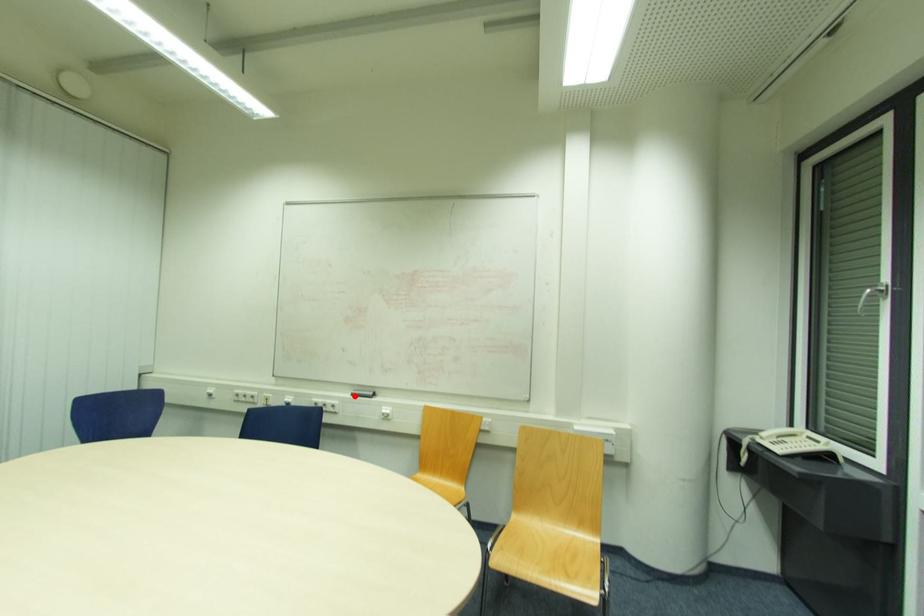
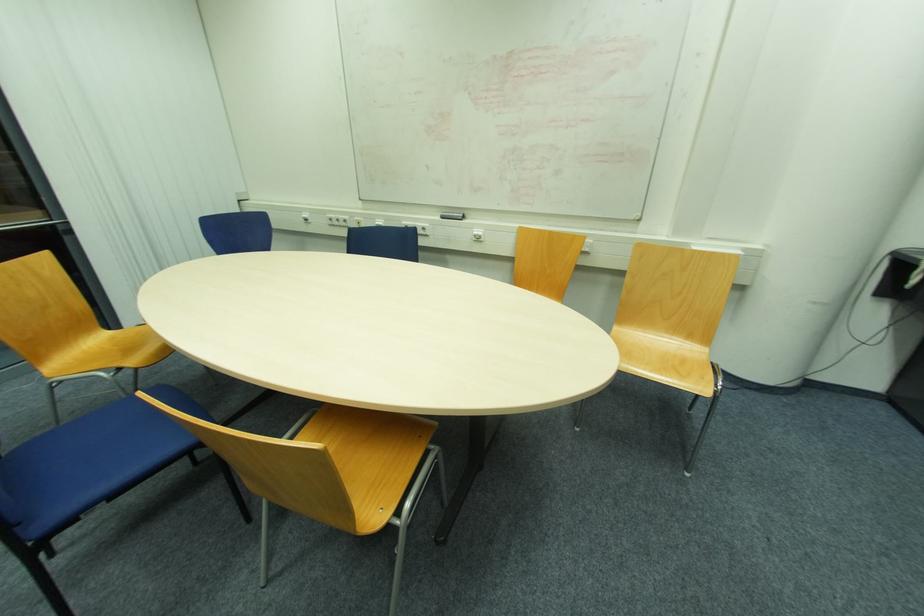
Question: I am providing you with two images of the same scene from different viewpoints. A red point is marked on the first image. Is the red point's position out of view in image 2?

Choices:
 (A) Yes
 (B) No

Answer: (B)